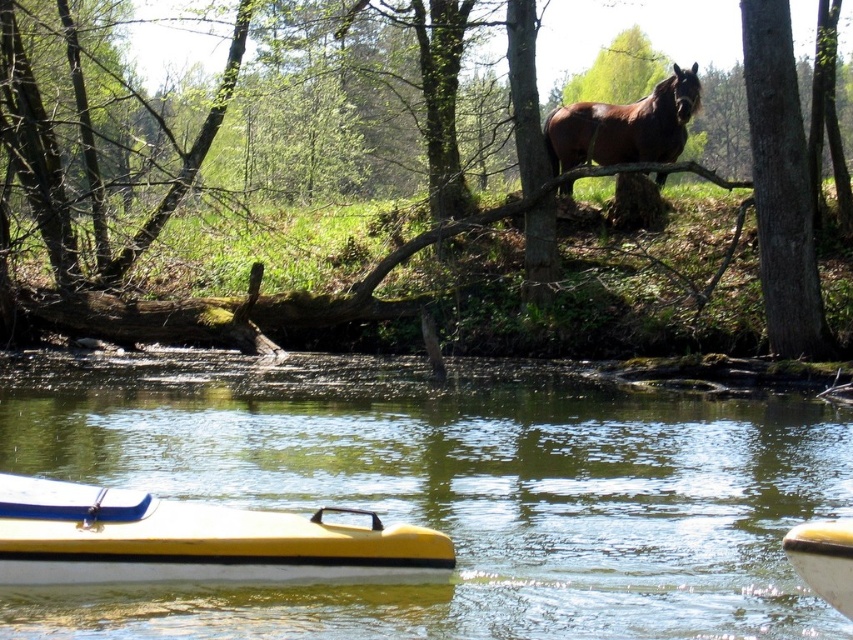
Question: Does brown wood tree at upper center appear on the right side of brown glossy horse at upper center?

Choices:
 (A) yes
 (B) no

Answer: (B)

Question: Where is yellow matte kayak at lower left located in relation to brown rough bark tree at upper right in the image?

Choices:
 (A) above
 (B) below

Answer: (B)

Question: Which of the following is the closest to the observer?

Choices:
 (A) yellow matte kayak at lower left
 (B) brown rough bark tree at upper right
 (C) brown glossy horse at upper center

Answer: (A)

Question: Among these points, which one is nearest to the camera?

Choices:
 (A) (842, 586)
 (B) (412, 410)
 (C) (616, 124)
 (D) (538, 236)

Answer: (A)

Question: Can you confirm if brown wood tree at upper center is positioned to the right of yellow matte kayak at lower left?

Choices:
 (A) yes
 (B) no

Answer: (A)

Question: Which point is closer to the camera taking this photo?

Choices:
 (A) (792, 529)
 (B) (572, 141)

Answer: (A)